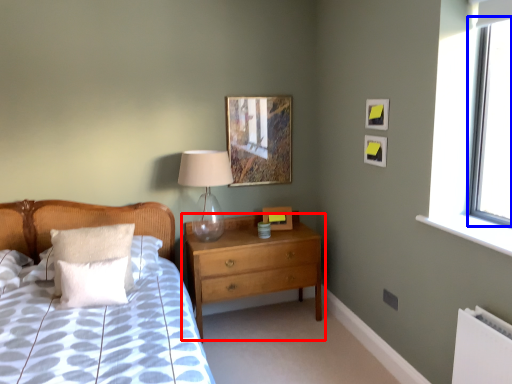
Question: Among these objects, which one is nearest to the camera, chest of drawers (highlighted by a red box) or window screen (highlighted by a blue box)?

Choices:
 (A) chest of drawers
 (B) window screen

Answer: (B)